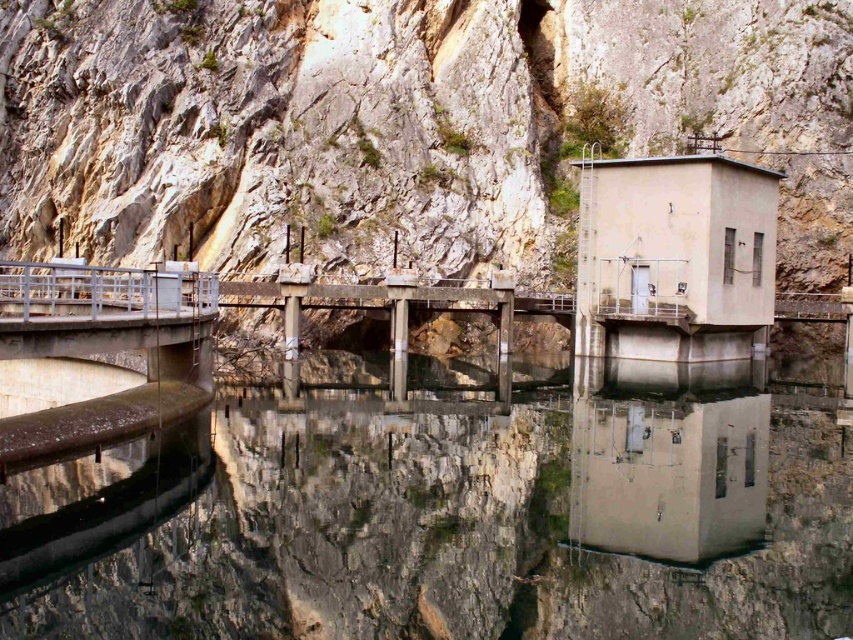
Question: Which point is closer to the camera?

Choices:
 (A) (706, 637)
 (B) (21, 97)

Answer: (A)

Question: Which point is farther to the camera?

Choices:
 (A) transparent concrete river at center
 (B) rough stone mountain at upper left

Answer: (B)

Question: Can you confirm if transparent concrete river at center is positioned below rough stone mountain at upper left?

Choices:
 (A) no
 (B) yes

Answer: (B)

Question: From the image, what is the correct spatial relationship of transparent concrete river at center in relation to rough stone mountain at upper left?

Choices:
 (A) below
 (B) above

Answer: (A)

Question: Which object appears closest to the camera in this image?

Choices:
 (A) rough stone mountain at upper left
 (B) transparent concrete river at center

Answer: (B)

Question: Does transparent concrete river at center appear on the right side of rough stone mountain at upper left?

Choices:
 (A) yes
 (B) no

Answer: (A)